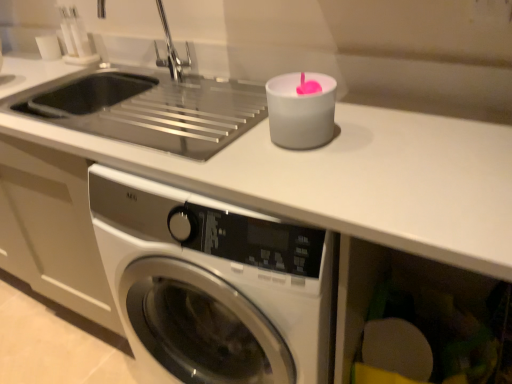
Question: Is white matte counter top at upper center a part of silver metallic faucet at upper left?

Choices:
 (A) no
 (B) yes

Answer: (A)

Question: Is silver metallic faucet at upper left not close to white matte counter top at upper center?

Choices:
 (A) yes
 (B) no

Answer: (B)

Question: Is silver metallic faucet at upper left to the left of white matte counter top at upper center from the viewer's perspective?

Choices:
 (A) yes
 (B) no

Answer: (A)

Question: Is silver metallic faucet at upper left outside white matte counter top at upper center?

Choices:
 (A) no
 (B) yes

Answer: (B)

Question: Is white matte counter top at upper center at the back of silver metallic faucet at upper left?

Choices:
 (A) yes
 (B) no

Answer: (B)

Question: Can you confirm if silver metallic faucet at upper left is bigger than white matte counter top at upper center?

Choices:
 (A) yes
 (B) no

Answer: (B)

Question: Does silver metallic faucet at upper left come behind matte plastic sponge at lower right?

Choices:
 (A) no
 (B) yes

Answer: (B)

Question: From the image's perspective, is silver metallic faucet at upper left on matte plastic sponge at lower right?

Choices:
 (A) yes
 (B) no

Answer: (A)

Question: Does silver metallic faucet at upper left have a larger size compared to matte plastic sponge at lower right?

Choices:
 (A) no
 (B) yes

Answer: (A)

Question: Is silver metallic faucet at upper left outside of matte plastic sponge at lower right?

Choices:
 (A) no
 (B) yes

Answer: (B)

Question: Is matte plastic sponge at lower right completely or partially inside silver metallic faucet at upper left?

Choices:
 (A) no
 (B) yes

Answer: (A)

Question: Considering the relative positions of silver metallic faucet at upper left and matte plastic sponge at lower right in the image provided, is silver metallic faucet at upper left to the left of matte plastic sponge at lower right from the viewer's perspective?

Choices:
 (A) no
 (B) yes

Answer: (B)

Question: From a real-world perspective, is white matte counter top at upper center located higher than silver metallic faucet at upper left?

Choices:
 (A) yes
 (B) no

Answer: (B)